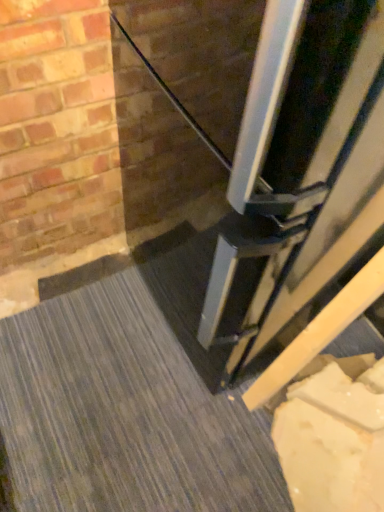
Question: In the image, is white matte concrete at lower right on the left side or the right side of black glossy door at lower center?

Choices:
 (A) right
 (B) left

Answer: (B)

Question: From a real-world perspective, is white matte concrete at lower right physically located above or below black glossy door at lower center?

Choices:
 (A) above
 (B) below

Answer: (B)

Question: Is point 112,399 positioned closer to the camera than point 276,12?

Choices:
 (A) farther
 (B) closer

Answer: (A)

Question: Considering the positions of point click(x=291, y=181) and point click(x=263, y=508), is point click(x=291, y=181) closer or farther from the camera than point click(x=263, y=508)?

Choices:
 (A) farther
 (B) closer

Answer: (B)

Question: Based on their sizes in the image, would you say black glossy door at lower center is bigger or smaller than white matte concrete at lower right?

Choices:
 (A) small
 (B) big

Answer: (B)

Question: In terms of width, does black glossy door at lower center look wider or thinner when compared to white matte concrete at lower right?

Choices:
 (A) thin
 (B) wide

Answer: (A)

Question: From the image's perspective, is black glossy door at lower center positioned above or below white matte concrete at lower right?

Choices:
 (A) below
 (B) above

Answer: (B)